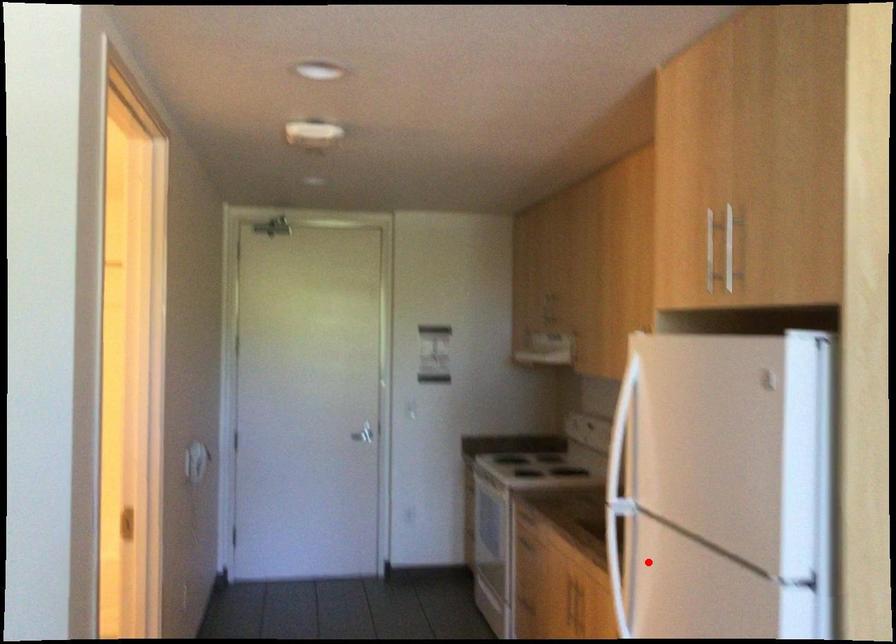
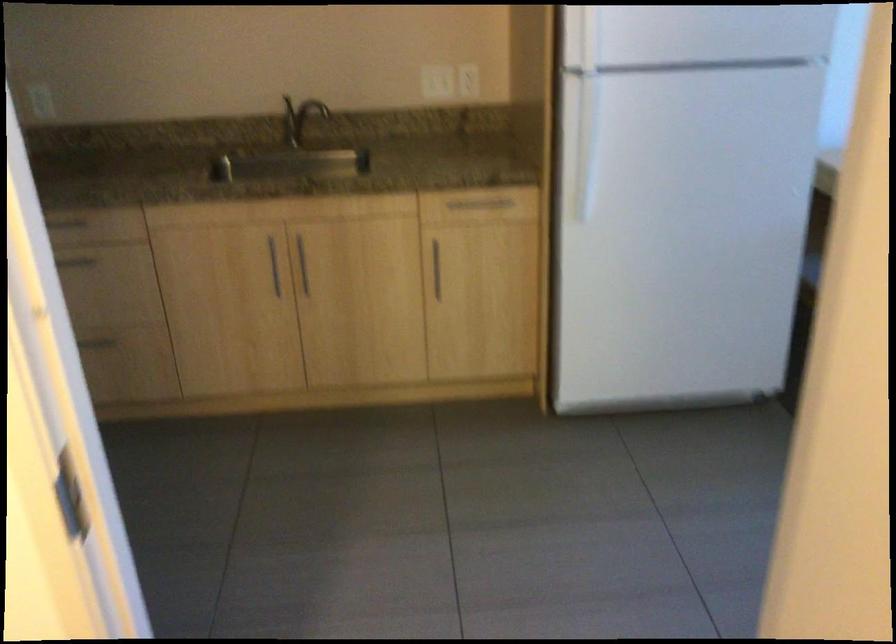
Where in the second image is the point corresponding to the highlighted location from the first image?

(586, 146)